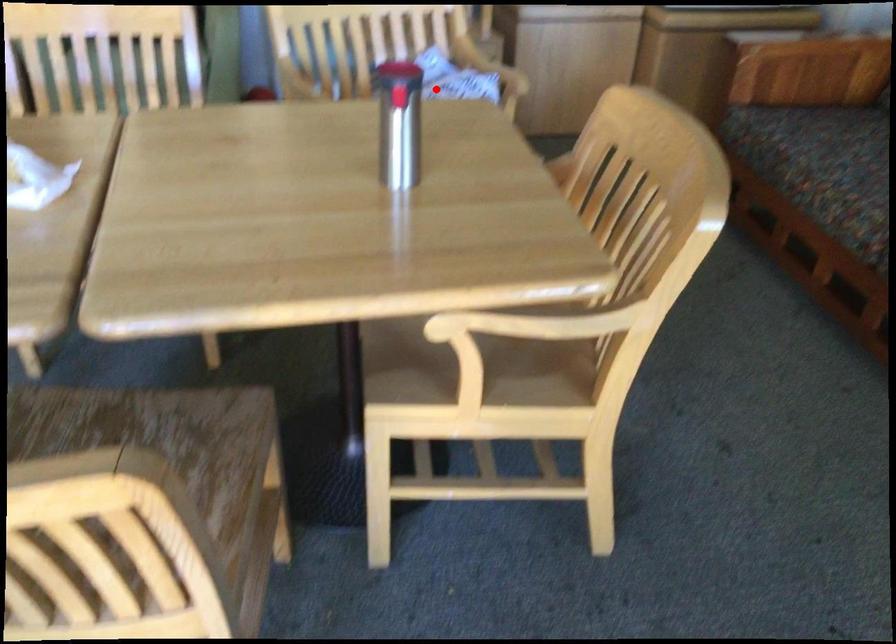
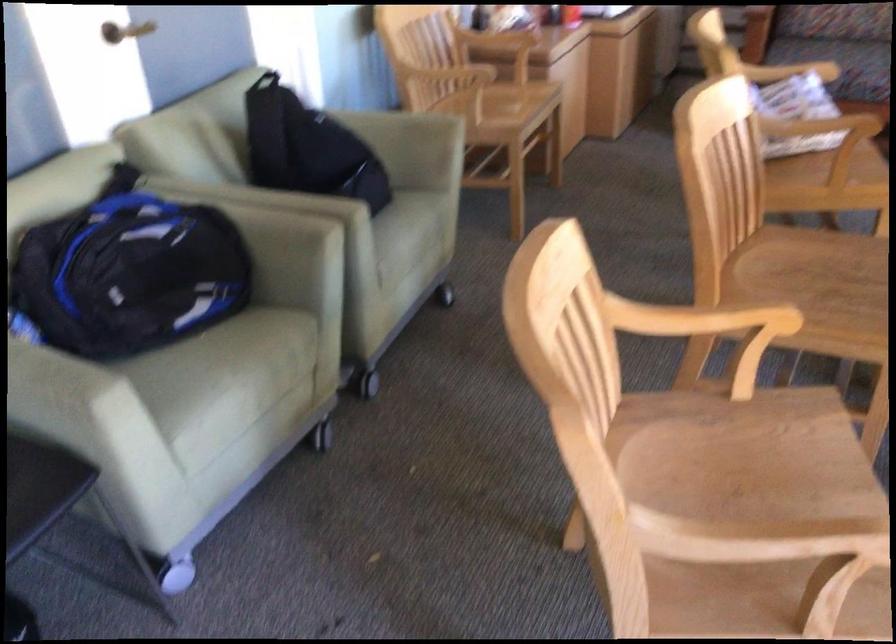
Where in the second image is the point corresponding to the highlighted location from the first image?

(790, 71)